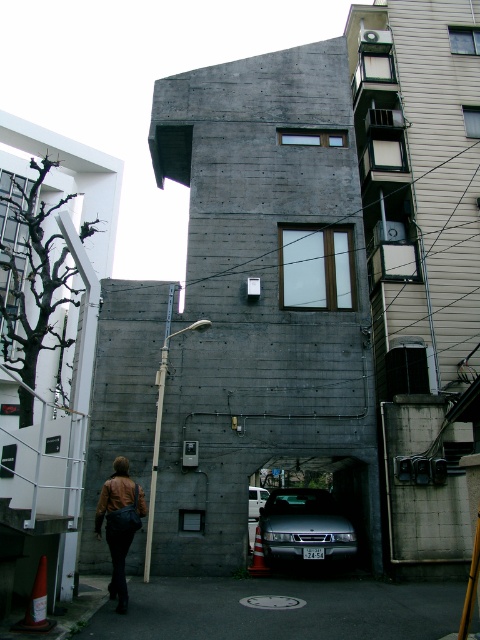
You are a delivery person who needs to place a large package on the ground. The package is the size of the metallic silver car at center. There is a spot where the brown leather jacket at lower left is currently located. Will the package fit in that spot?

The brown leather jacket at lower left is smaller than the metallic silver car at center. Since the package is as large as the car, it won

You are standing in front of the modern architectural structure and want to determine the relative positions of two points marked on the facade. Which of the two points, point 1 at coordinates point [313,544] or point 2 at coordinates point [122,483], is closer to you?

Point 1 at coordinates point [313,544] is closer to you because it is further to the viewer than point 2 at coordinates point [122,483].

You are standing in front of the modern architectural structure and want to determine the relative positions of two points marked on the facade. Which of the two points, point 1 at coordinates (305, 531) or point 2 at (257, 515), is closer to you?

Point 1 at coordinates (305, 531) is closer to the viewer than point 2 at (257, 515).